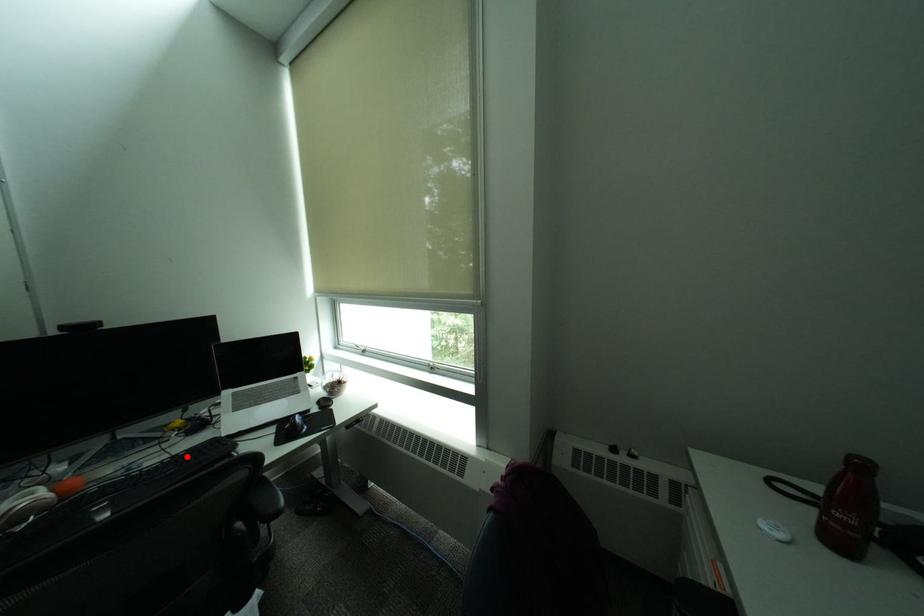
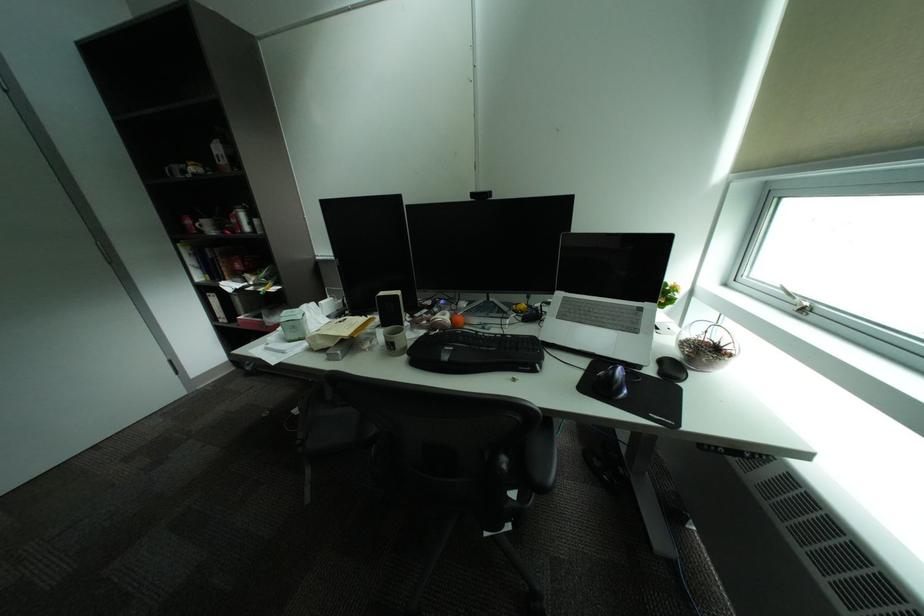
Question: I am providing you with two images of the same scene from different viewpoints. A red point is marked on the first image. Is the red point's position out of view in image 2?

Choices:
 (A) Yes
 (B) No

Answer: (B)